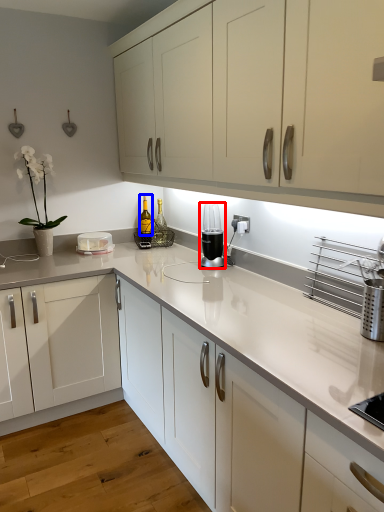
Question: Which object appears closest to the camera in this image, home appliance (highlighted by a red box) or bottle (highlighted by a blue box)?

Choices:
 (A) home appliance
 (B) bottle

Answer: (A)